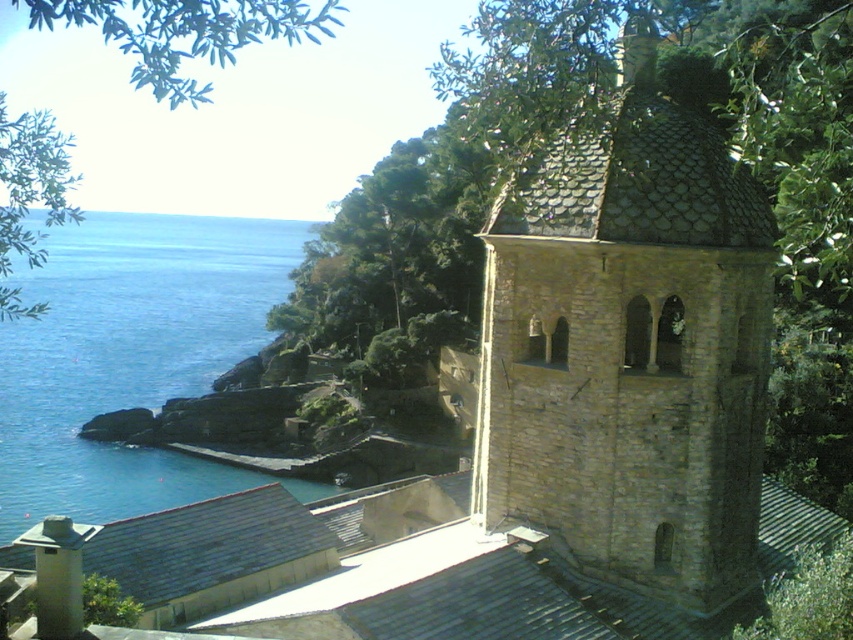
Based on the photo, you are standing at the edge of the blue water at lower left and want to reach the brown stone church tower at center. Which direction should you head towards?

The brown stone church tower at center is positioned on the right side of blue water at lower left, so you should head to the right to reach it.

You are an architect designing a new coastal village. You want to ensure that the brown stone church tower at center and the blue water at lower left are both visible from the main square. Based on their sizes in the image, which one will appear smaller in the design?

The brown stone church tower at center occupies less space than the blue water at lower left, so it will appear smaller in the design.